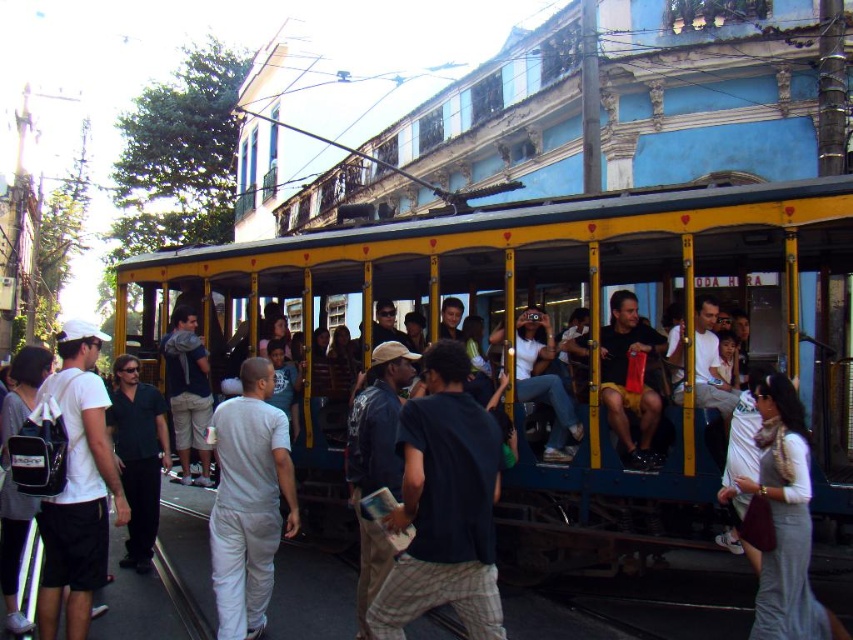
You are a delivery person who needs to place a package in the yellow painted metal trolley at center. The package is as wide as the matte black backpack at left. Can the package fit inside the trolley?

The yellow painted metal trolley at center is wider than the matte black backpack at left, so the package can fit inside the trolley since its width is equal to the backpack.

You are standing on the street and see the yellow painted metal trolley at center and the matte black backpack at left. Which object is taller?

The yellow painted metal trolley at center is taller than the matte black backpack at left.